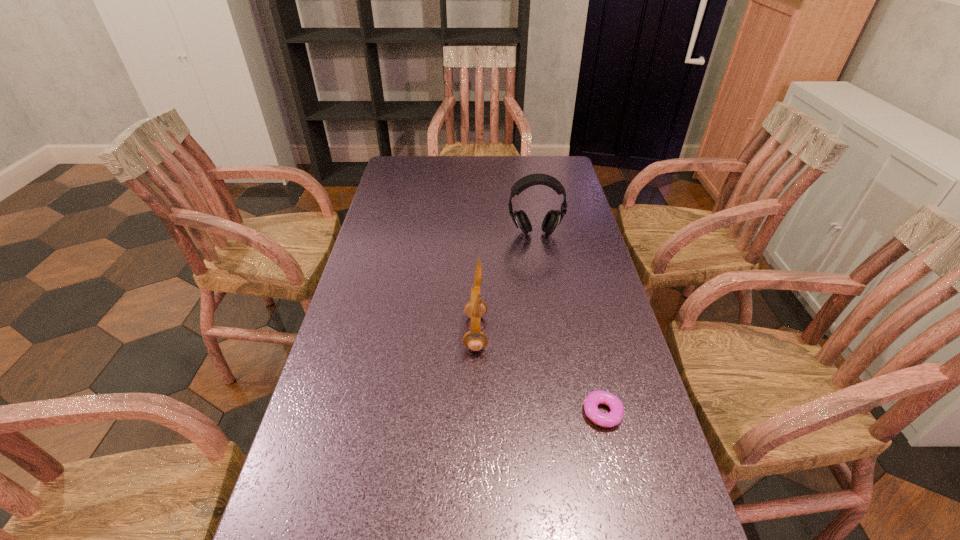
Locate an element on the screen. vacant space that satisfies the following two spatial constraints: 1. on the ear cups of the farthest object; 2. on the left side of the doughnut is located at coordinates (564, 413).

The height and width of the screenshot is (540, 960). Identify the location of free location that satisfies the following two spatial constraints: 1. on the ear cups of the right earphone; 2. on the front-facing side of the left earphone. (551, 333).

You are a GUI agent. You are given a task and a screenshot of the screen. Output one action in this format:
    pyautogui.click(x=<x>, y=<y>)
    Task: Click on the free space that satisfies the following two spatial constraints: 1. on the ear cups of the farther earphone; 2. on the left side of the shortest object
    
    Given the screenshot: What is the action you would take?
    pyautogui.click(x=564, y=413)

You are a GUI agent. You are given a task and a screenshot of the screen. Output one action in this format:
    pyautogui.click(x=<x>, y=<y>)
    Task: Click on the free spot that satisfies the following two spatial constraints: 1. on the front-facing side of the nearer earphone; 2. on the back side of the doughnut
    The image size is (960, 540).
    Given the screenshot: What is the action you would take?
    pyautogui.click(x=475, y=413)

The width and height of the screenshot is (960, 540). I want to click on free point that satisfies the following two spatial constraints: 1. on the ear cups of the doughnut; 2. on the left side of the farthest object, so click(564, 413).

The height and width of the screenshot is (540, 960). I want to click on vacant space that satisfies the following two spatial constraints: 1. on the front-facing side of the shortest object; 2. on the left side of the nearer earphone, so click(475, 413).

At what (x,y) coordinates should I click in order to perform the action: click on vacant point that satisfies the following two spatial constraints: 1. on the front-facing side of the second farthest object; 2. on the right side of the nearest object. Please return your answer as a coordinate pair (x, y). This screenshot has width=960, height=540. Looking at the image, I should click on (475, 413).

Locate an element on the screen. blank area in the image that satisfies the following two spatial constraints: 1. on the ear cups of the farther earphone; 2. on the front-facing side of the second farthest object is located at coordinates (551, 333).

Where is `vacant space that satisfies the following two spatial constraints: 1. on the front-facing side of the left earphone; 2. on the left side of the shortest object`? This screenshot has height=540, width=960. vacant space that satisfies the following two spatial constraints: 1. on the front-facing side of the left earphone; 2. on the left side of the shortest object is located at coordinates (475, 413).